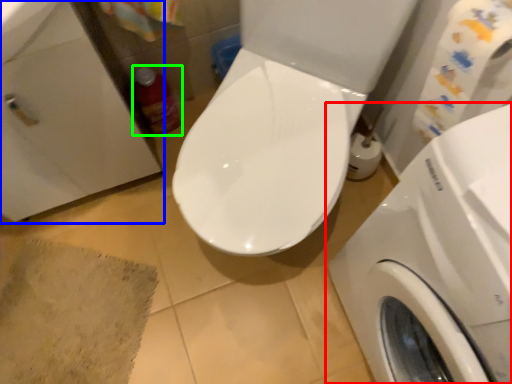
Question: Based on their relative distances, which object is nearer to washing machine (highlighted by a red box)? Choose from sink (highlighted by a blue box) and cleaning product (highlighted by a green box).

Choices:
 (A) sink
 (B) cleaning product

Answer: (A)